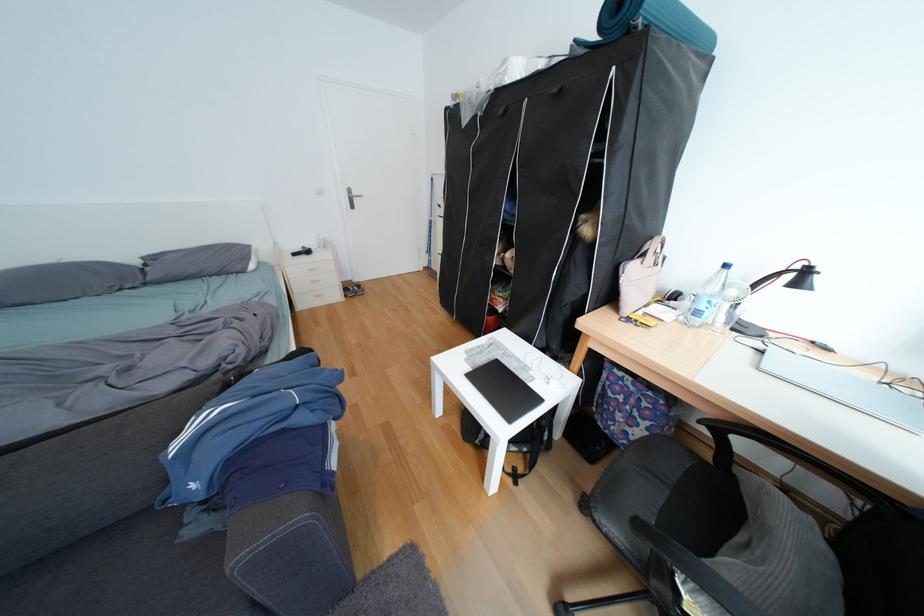
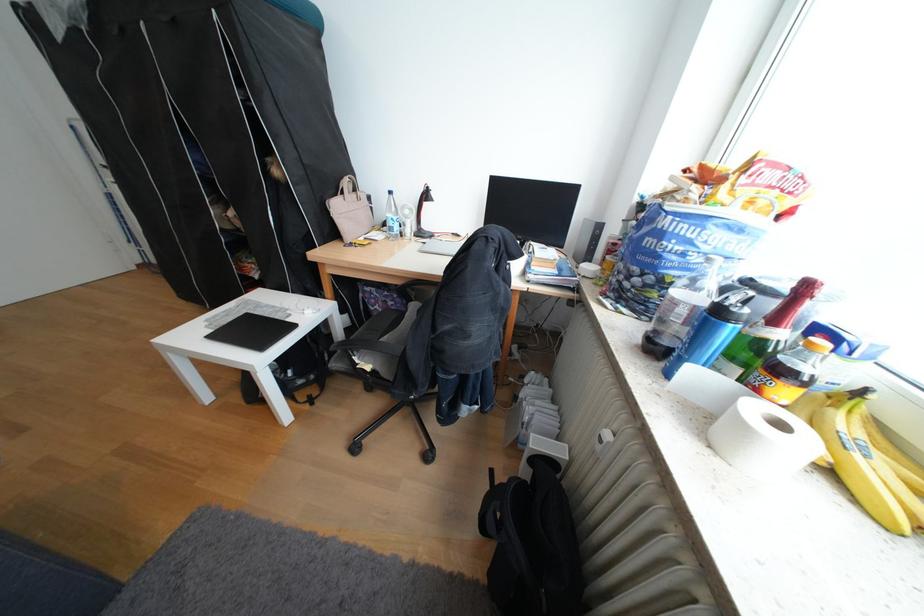
Question: The camera is either moving clockwise (left) or counter-clockwise (right) around the object. The first image is from the beginning of the video and the second image is from the end. Is the camera moving left or right when shooting the video?

Choices:
 (A) Left
 (B) Right

Answer: (A)